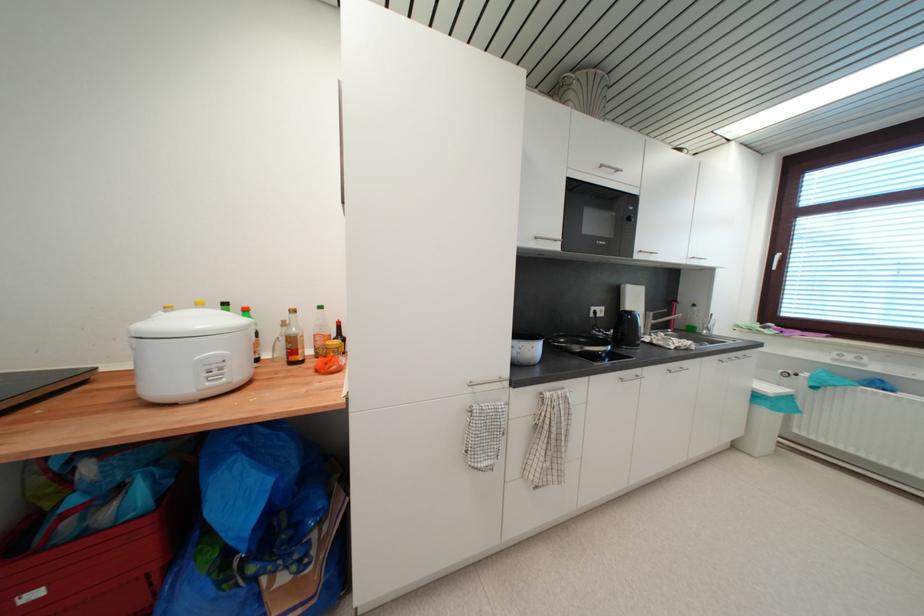
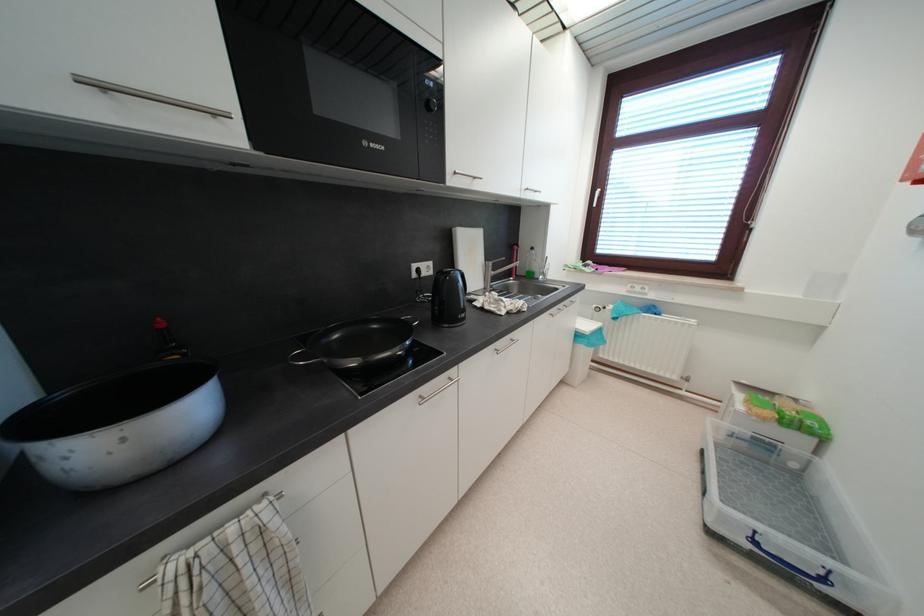
Where in the second image is the point corresponding to (x=652, y=312) from the first image?

(492, 261)